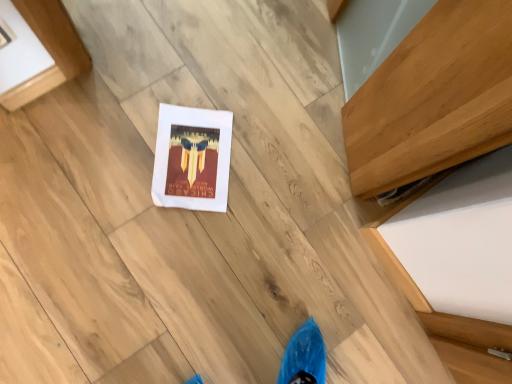
You are a GUI agent. You are given a task and a screenshot of the screen. Output one action in this format:
    pyautogui.click(x=<x>, y=<y>)
    Task: Click on the vacant space that is to the left of white paper at center
    
    Given the screenshot: What is the action you would take?
    pyautogui.click(x=125, y=117)